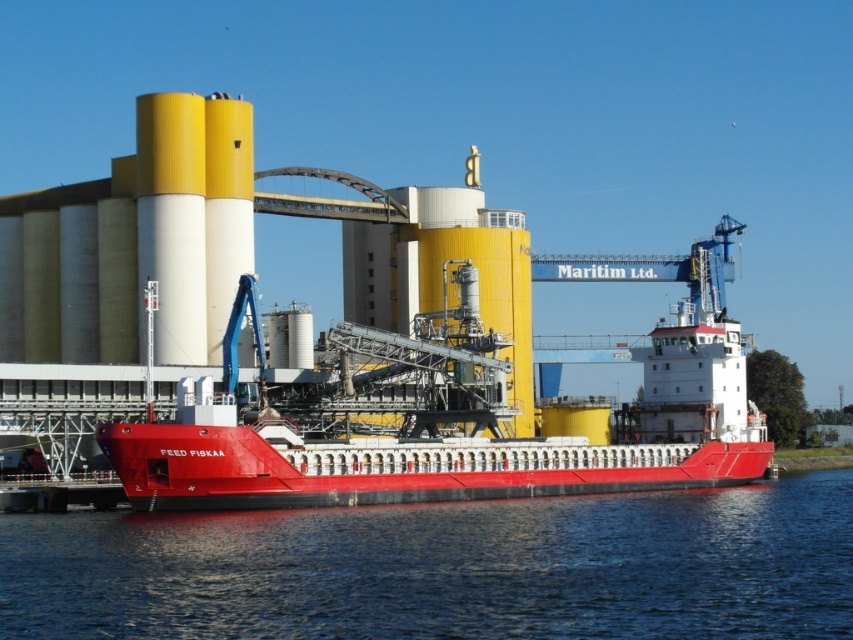
Looking at this image, you are standing on the deck of the large red barge named FEED FISKAA at the port. You notice a point marked at coordinates (445, 566). Based on the scene description, what is located at that point?

The point at coordinates (445, 566) marks transparent blue water at lower center.

You are a crane operator at the port. You need to lower a heavy container onto the metallic red barge at center. The container is as wide as the transparent blue water at lower center. Will the container fit on the barge?

The transparent blue water at lower center is wider than the metallic red barge at center. Since the container is as wide as the water, it will not fit on the barge because the barge is narrower than the water.

You are a crane operator at the port and need to lower a heavy container onto the metallic red barge at center. The container is 10 meters long. Can you safely lower it onto the barge without it touching the transparent blue water at lower center?

The transparent blue water at lower center is located below the metallic red barge at center, so as long as the container is placed on the barge itself, it will not touch the water below.